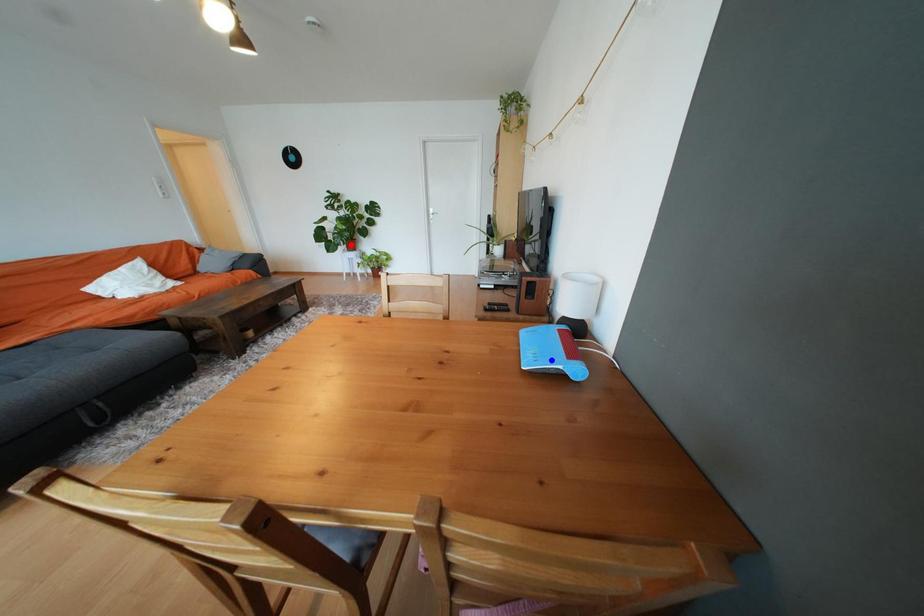
Question: In the image, two points are highlighted. Which point is nearer to the camera? Reply with the corresponding letter.

Choices:
 (A) blue point
 (B) red point

Answer: (A)